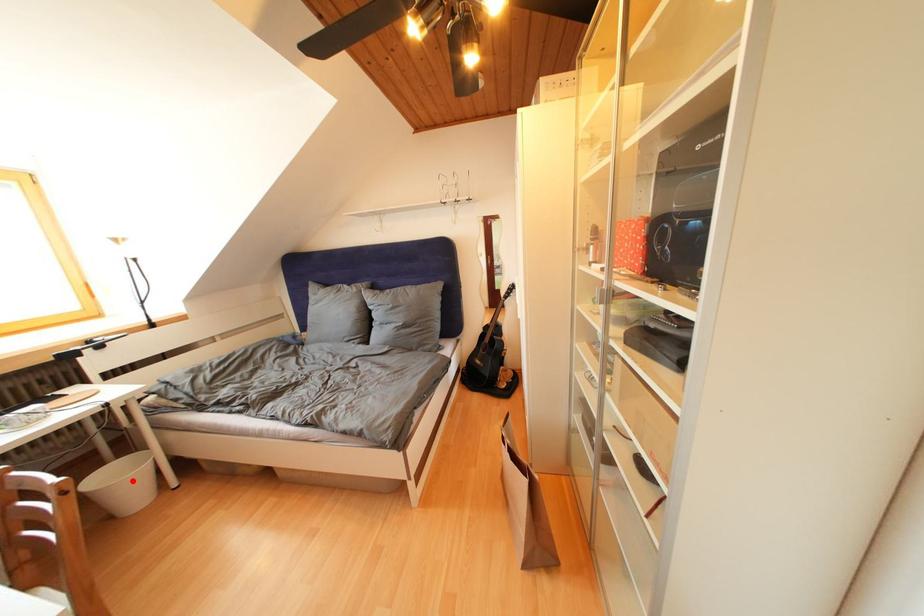
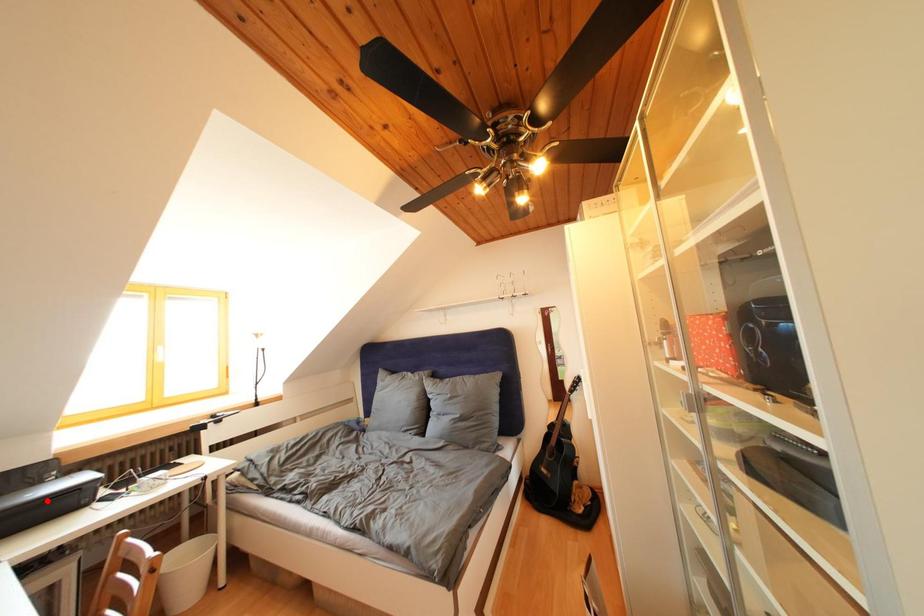
I am providing you with two images of the same scene from different viewpoints. A red point is marked on the first image and another point is marked on the second image. Is the marked point in image1 the same physical position as the marked point in image2?

No